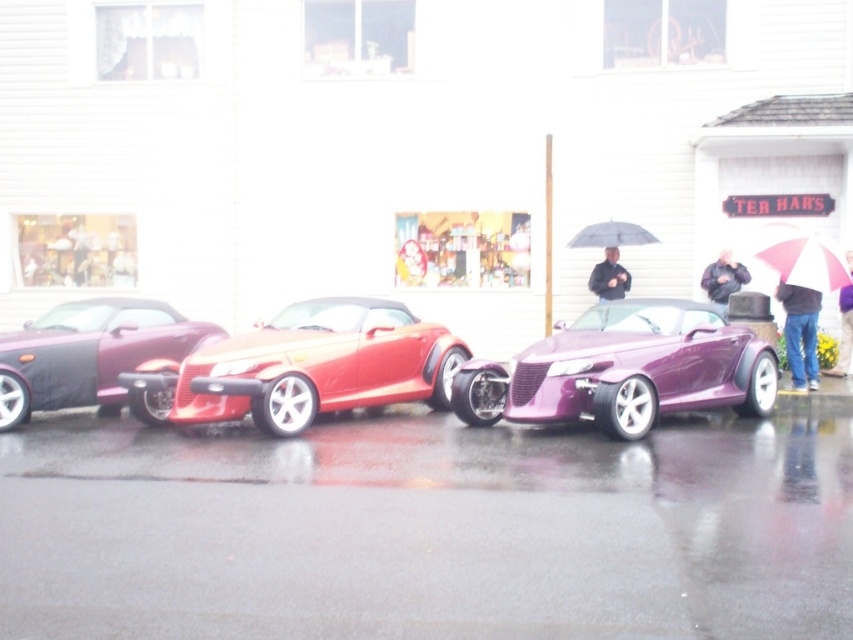
Can you confirm if shiny metallic car at center is thinner than dark gray jacket at center?

In fact, shiny metallic car at center might be wider than dark gray jacket at center.

Who is higher up, shiny metallic car at center or dark gray jacket at center?

dark gray jacket at center

The height and width of the screenshot is (640, 853). Describe the element at coordinates (308, 365) in the screenshot. I see `shiny metallic car at center` at that location.

The width and height of the screenshot is (853, 640). Identify the location of shiny metallic car at center. (308, 365).

Is metallic purple car at center taller than dark gray jacket at center?

Indeed, metallic purple car at center has a greater height compared to dark gray jacket at center.

Between metallic purple car at center and dark gray jacket at center, which one has more height?

Standing taller between the two is metallic purple car at center.

At what (x,y) coordinates should I click in order to perform the action: click on metallic purple car at center. Please return your answer as a coordinate pair (x, y). Looking at the image, I should click on (624, 369).

Who is higher up, jeans at lower right or black leather jacket at center?

black leather jacket at center

Which of these two, jeans at lower right or black leather jacket at center, stands taller?

jeans at lower right

Locate an element on the screen. jeans at lower right is located at coordinates (799, 332).